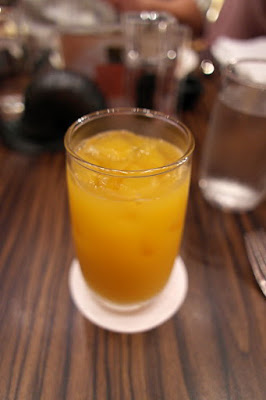
Where is `glass pitcher`? This screenshot has height=400, width=266. glass pitcher is located at coordinates (232, 124).